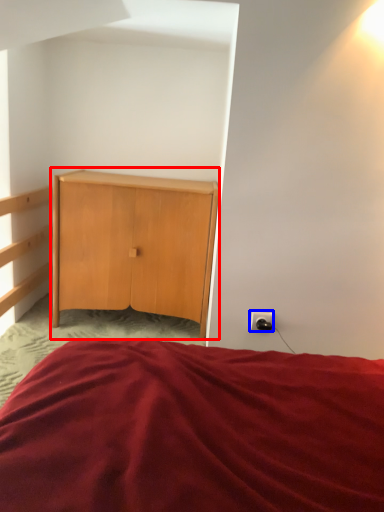
Question: Which point is further to the camera, nightstand (highlighted by a red box) or electric outlet (highlighted by a blue box)?

Choices:
 (A) nightstand
 (B) electric outlet

Answer: (A)